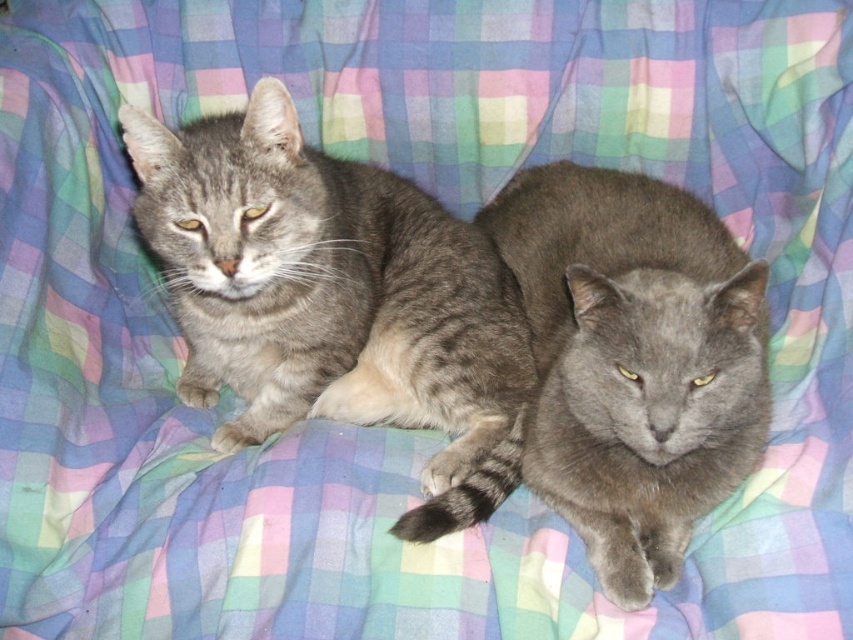
You are standing at the center of the bed and want to pet the gray tabby cat at left. According to the coordinates provided, in which direction should you move to reach the cat?

The gray tabby cat at left is located at coordinates point (x=334, y=298), so you should move to the left and slightly forward to reach it.

You are a cat owner who wants to place a small toy between the gray tabby cat at left and the gray fluffy cat at center. The toy requires at least 30 centimeters of space to be placed safely. Can you fit the toy between them?

The distance between the gray tabby cat at left and the gray fluffy cat at center is 25.60 centimeters, which is less than the required 30 centimeters. Therefore, the toy cannot be safely placed between them.